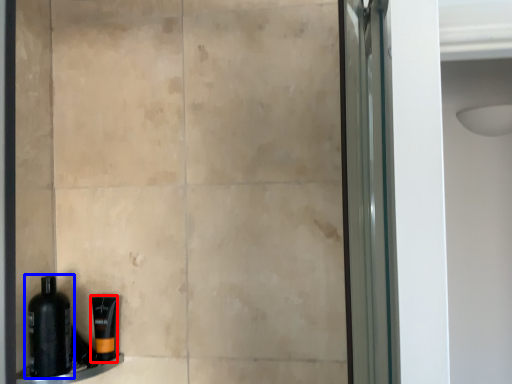
Question: Which point is further to the camera, toiletry (highlighted by a red box) or bottle (highlighted by a blue box)?

Choices:
 (A) toiletry
 (B) bottle

Answer: (A)